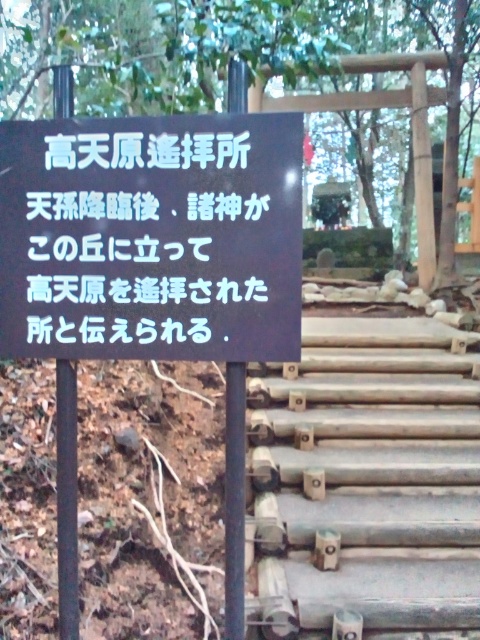
Question: Is black matte sign at center further to camera compared to smooth wooden stairs at center?

Choices:
 (A) yes
 (B) no

Answer: (B)

Question: Which of the following is the closest to the observer?

Choices:
 (A) smooth wooden stairs at center
 (B) black matte sign at center

Answer: (B)

Question: Among these objects, which one is nearest to the camera?

Choices:
 (A) black matte sign at center
 (B) smooth wooden stairs at center

Answer: (A)

Question: Can you confirm if black matte sign at center is positioned to the right of smooth wooden stairs at center?

Choices:
 (A) no
 (B) yes

Answer: (A)

Question: Which point is farther to the camera?

Choices:
 (A) black matte sign at center
 (B) smooth wooden stairs at center

Answer: (B)

Question: Can you confirm if black matte sign at center is thinner than smooth wooden stairs at center?

Choices:
 (A) yes
 (B) no

Answer: (A)